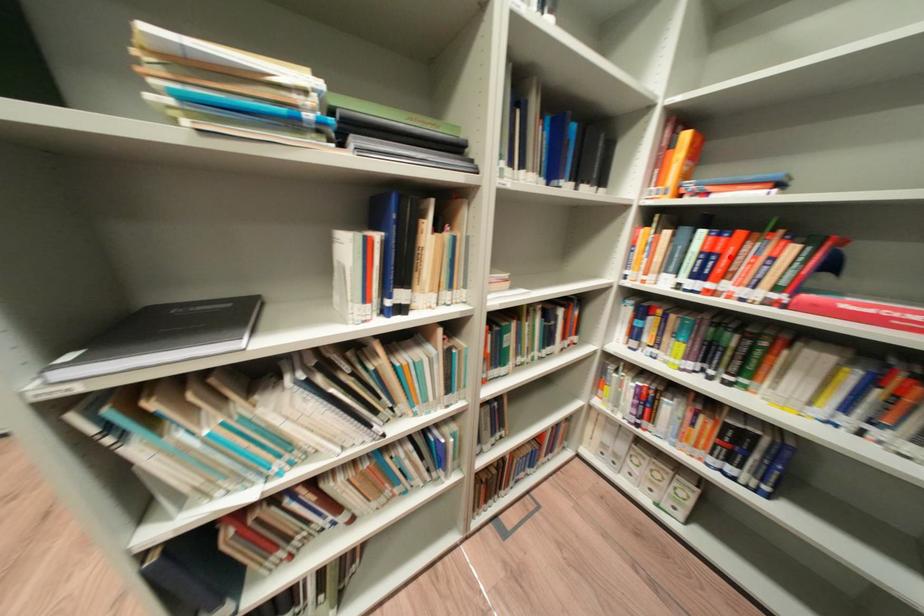
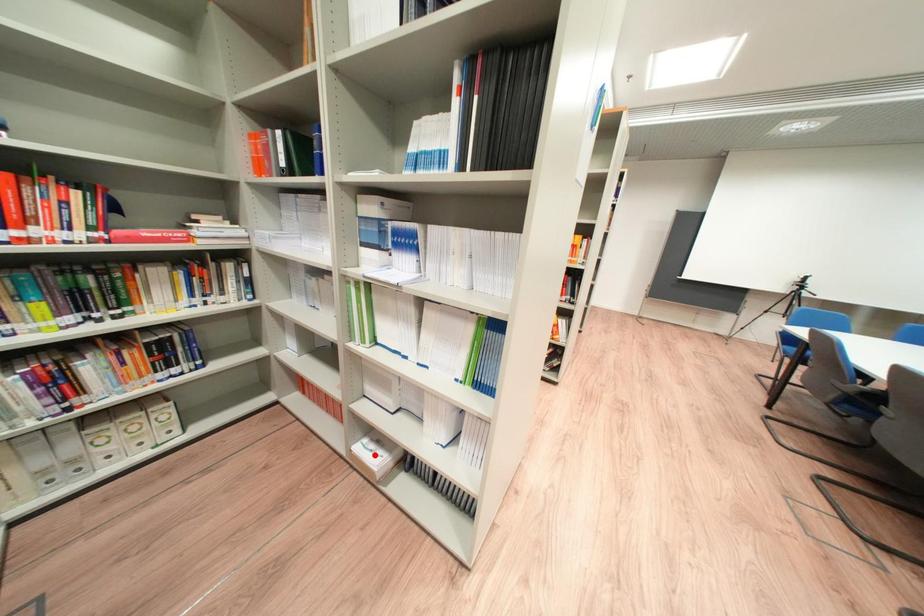
I am providing you with two images of the same scene from different viewpoints. A red point is marked on the first image and another point is marked on the second image. Is the red point in image1 aligned with the point shown in image2?

No